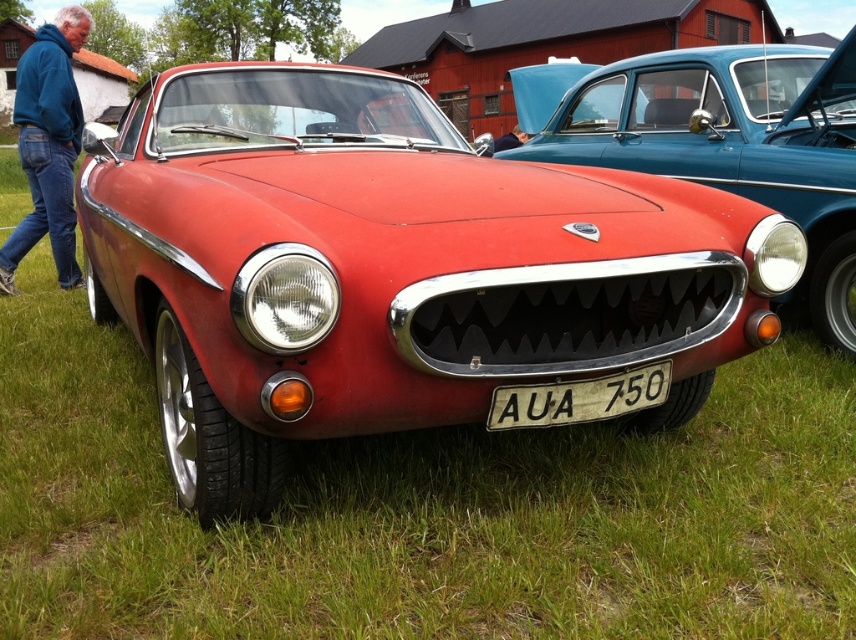
Question: Which is nearer to the matte black car at center?

Choices:
 (A) white plastic license plate at center
 (B) blue fleece jacket at upper left

Answer: (A)

Question: Is matte black car at center positioned in front of blue fleece jacket at upper left?

Choices:
 (A) no
 (B) yes

Answer: (B)

Question: Which of the following is the closest to the observer?

Choices:
 (A) (800, 124)
 (B) (69, 227)

Answer: (A)

Question: Observing the image, what is the correct spatial positioning of matte black car at center in reference to blue fleece jacket at upper left?

Choices:
 (A) right
 (B) left

Answer: (A)

Question: Among these points, which one is farthest from the camera?

Choices:
 (A) (569, 116)
 (B) (39, 134)
 (C) (586, 380)

Answer: (A)

Question: Is matte black car at center to the left of blue fleece jacket at upper left from the viewer's perspective?

Choices:
 (A) no
 (B) yes

Answer: (A)